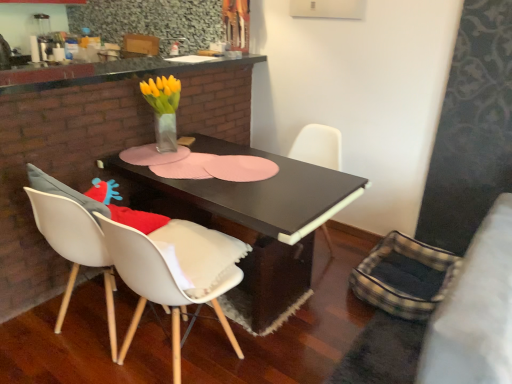
Locate an element on the screen. vacant space underneath white matte chair at lower left, the second chair viewed from the back (from a real-world perspective) is located at coordinates (184, 366).